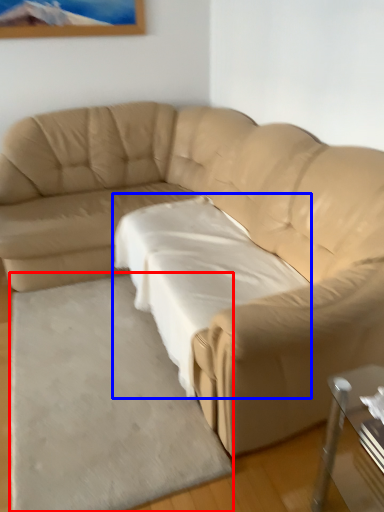
Question: Which object is further to the camera taking this photo, mat (highlighted by a red box) or sheet (highlighted by a blue box)?

Choices:
 (A) mat
 (B) sheet

Answer: (B)